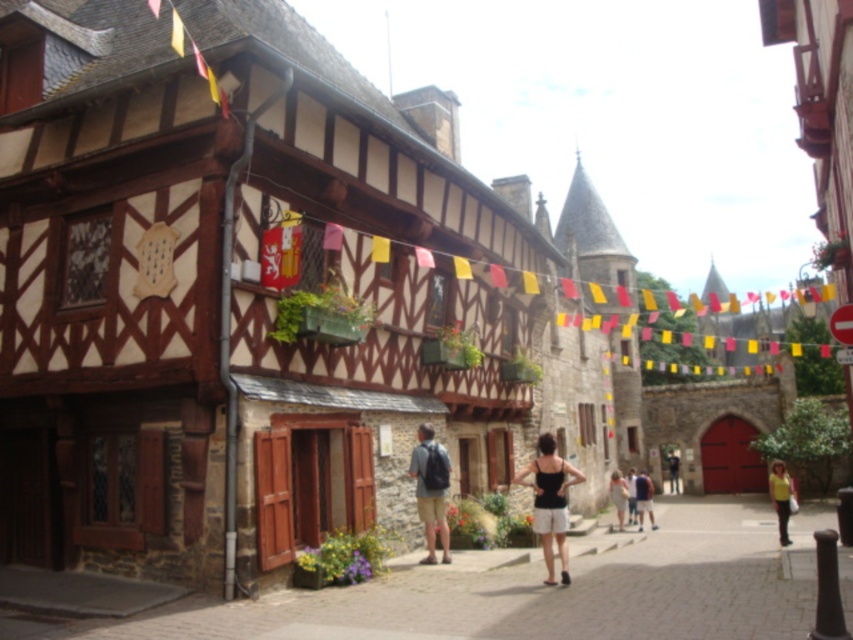
Question: Is stone paved alley at center further to the viewer compared to light brown leather shoes at center?

Choices:
 (A) no
 (B) yes

Answer: (A)

Question: Considering the relative positions of stone paved alley at center and matte black backpack at center in the image provided, where is stone paved alley at center located with respect to matte black backpack at center?

Choices:
 (A) above
 (B) below

Answer: (B)

Question: Based on their relative distances, which object is nearer to the light brown leather shoes at center?

Choices:
 (A) yellow matte shirt at lower right
 (B) matte black backpack at center
 (C) stone paved alley at center

Answer: (A)

Question: Which object is closer to the camera taking this photo?

Choices:
 (A) yellow matte shirt at lower right
 (B) light brown leather shoes at center
 (C) matte black backpack at center
 (D) stone paved alley at center

Answer: (D)

Question: Can you confirm if light brown leather shoes at center is thinner than yellow matte shirt at lower right?

Choices:
 (A) no
 (B) yes

Answer: (B)

Question: Which point is closer to the camera?

Choices:
 (A) (769, 492)
 (B) (566, 472)

Answer: (B)